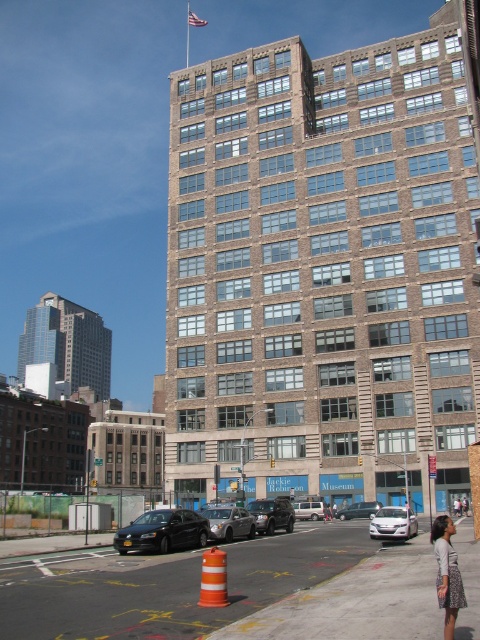
You are a delivery driver who needs to park your vehicle in the parking lot behind the Jackie Robinson Museum. The parking lot has a designated parking spot at point 0.817, 0.477. Can you determine if the silver metallic sedan at center is blocking your parking spot?

The silver metallic sedan at center is positioned at point (228,522), which matches the coordinates of the designated parking spot. Therefore, the silver metallic sedan at center is blocking your parking spot.